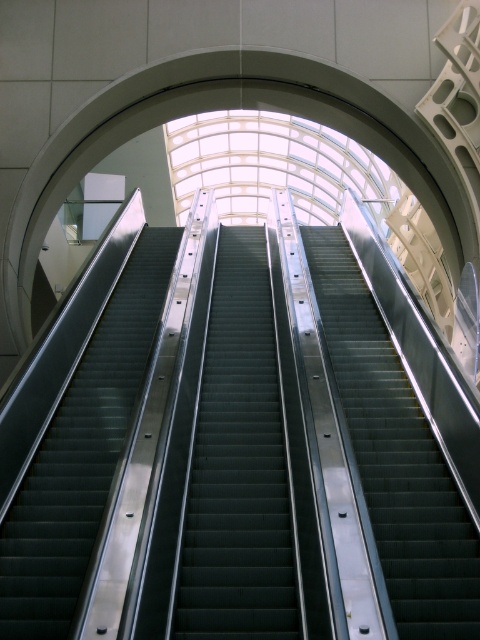
Consider the image. You are an architect designing a new building and want to ensure accessibility for all visitors. You need to determine which of the two structures, the metallic gray stairs at center or the metallic escalator steps at center, requires more space for wheelchair access. Based on the image, which one would you prioritize for modification?

The metallic gray stairs at center is smaller than the metallic escalator steps at center, so the metallic gray stairs at center would require more space for wheelchair access and should be prioritized for modification.

You are a maintenance worker inspecting the escalators in the building. You need to determine which of the two metallic structures, the metallic escalator steps at center or the metallic silver escalator at left, requires a taller safety barrier for its upper section. Based on their heights, which one would need a taller barrier?

The metallic silver escalator at left requires a taller safety barrier because it is taller than the metallic escalator steps at center.

In the scene shown: You are a maintenance worker needing to inspect the metallic escalator steps at center and the metallic silver escalator at left. Which one is located directly above the other?

The metallic escalator steps at center is positioned under the metallic silver escalator at left, so the metallic silver escalator at left is directly above the metallic escalator steps at center.